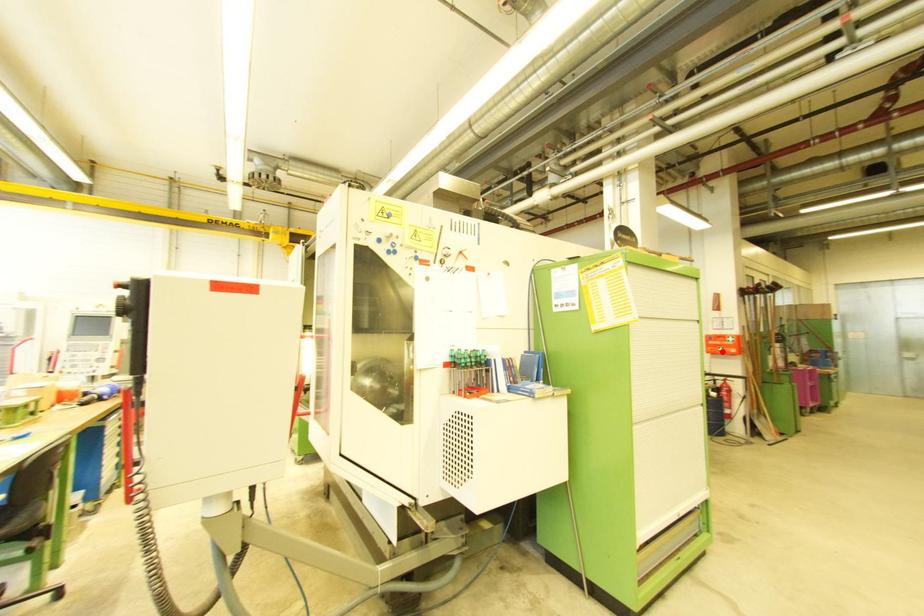
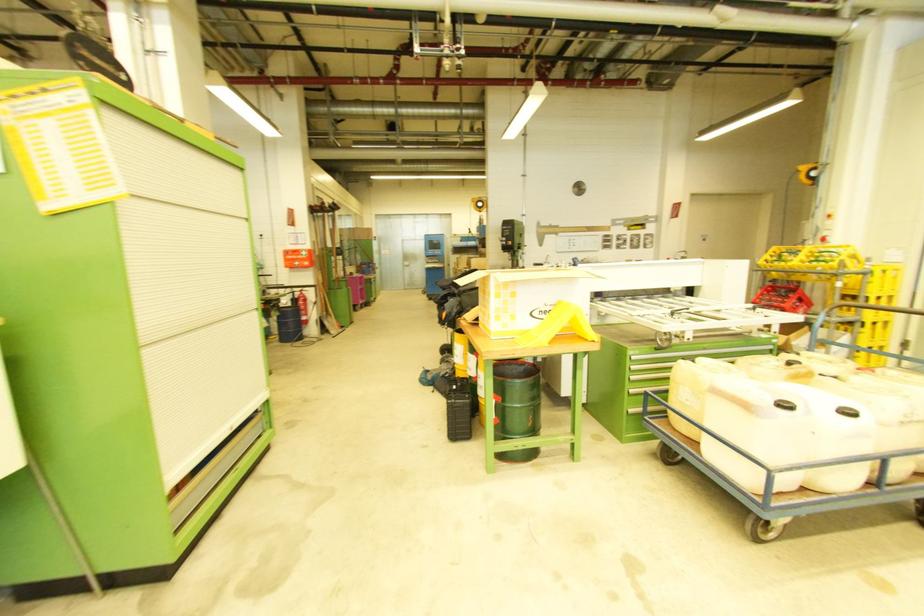
Question: I am providing you with two images of the same scene from different viewpoints. In image1, a red point is highlighted. Considering the same 3D point in image2, which of the following is correct?

Choices:
 (A) It is closer
 (B) It is farther

Answer: (A)